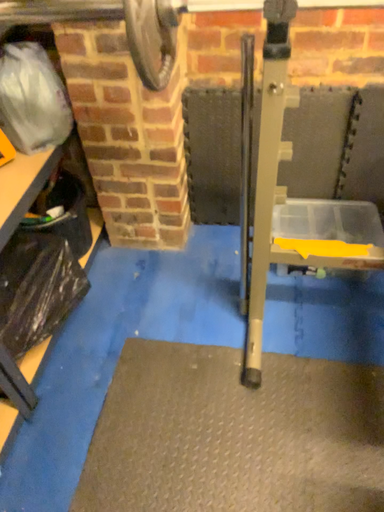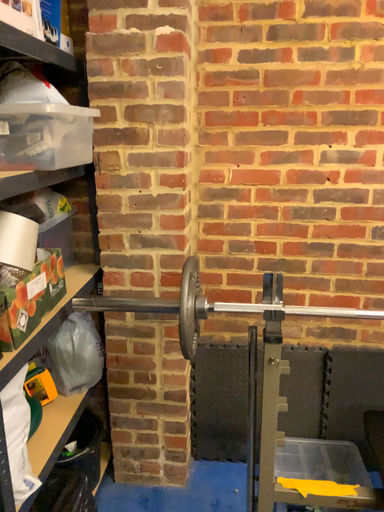
Question: How did the camera likely rotate when shooting the video?

Choices:
 (A) rotated upward
 (B) rotated downward

Answer: (A)